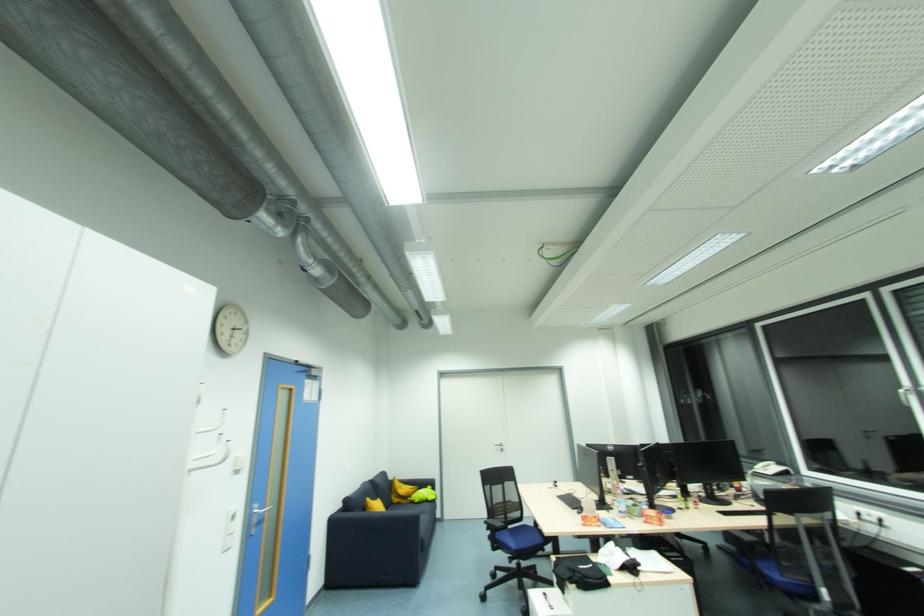
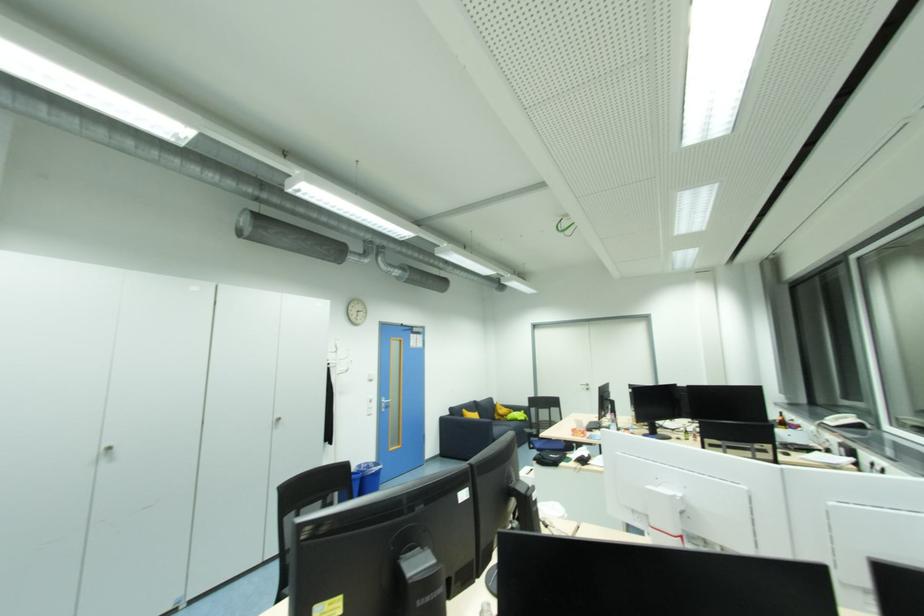
Locate, in the second image, the point that corresponds to [334,525] in the first image.

(445, 421)